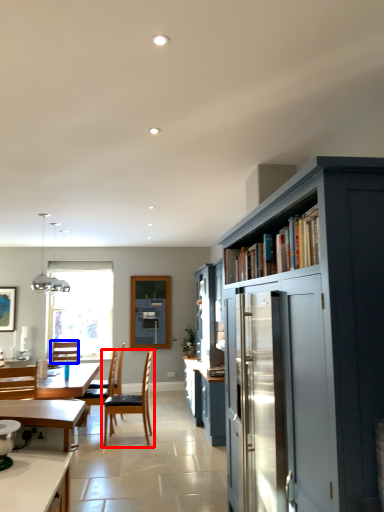
Question: Which object appears farthest to the camera in this image, chair (highlighted by a red box) or chair (highlighted by a blue box)?

Choices:
 (A) chair
 (B) chair

Answer: (B)